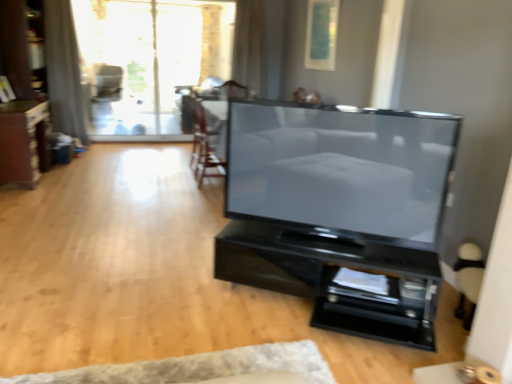
This screenshot has height=384, width=512. I want to click on vacant area on the back side of white textured rug at lower center, so click(x=178, y=302).